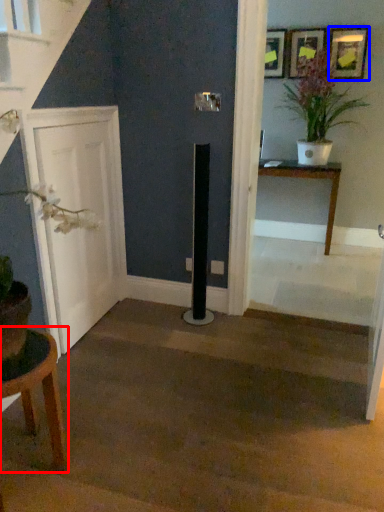
Question: Which object appears closest to the camera in this image, table (highlighted by a red box) or picture frame (highlighted by a blue box)?

Choices:
 (A) table
 (B) picture frame

Answer: (A)